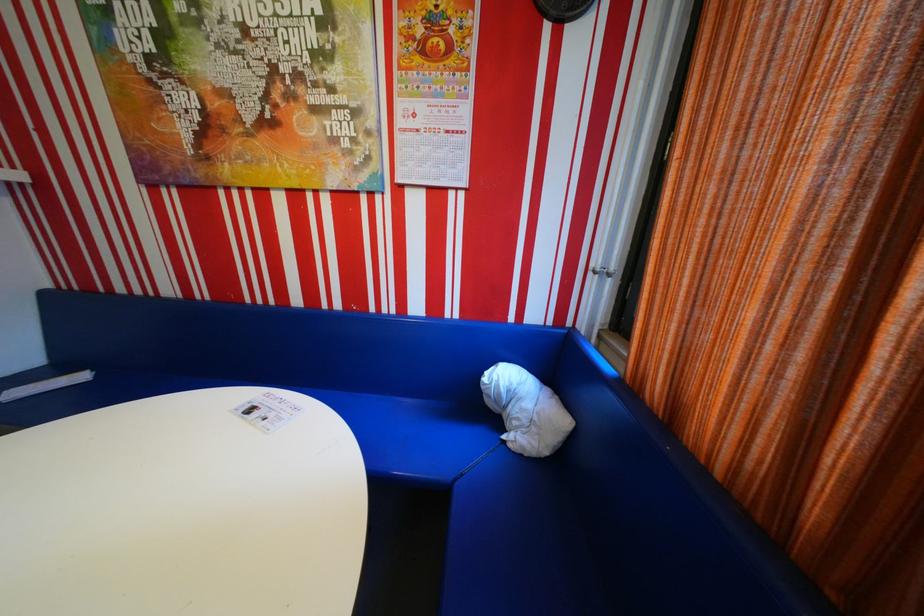
This screenshot has width=924, height=616. What are the coordinates of `metal window handle` in the screenshot? It's located at (602, 270).